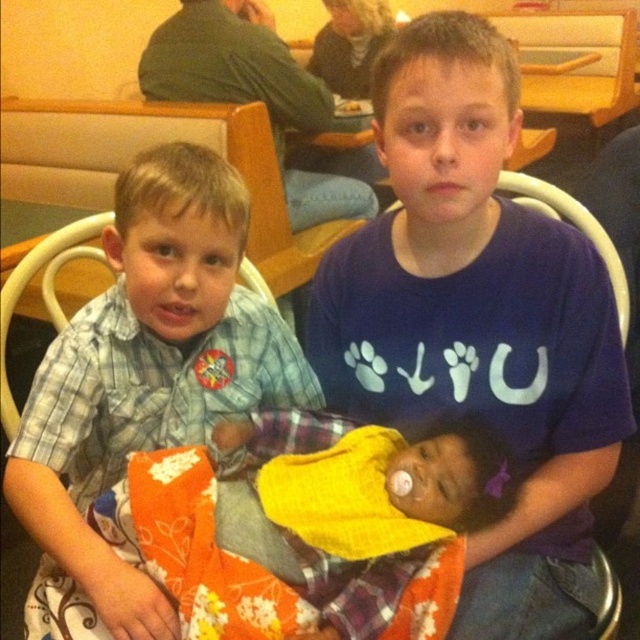
Can you confirm if blue cotton shirt at center is thinner than blue plaid shirt at center?

No.

Find the location of a particular element. The image size is (640, 640). blue cotton shirt at center is located at coordinates (477, 324).

Who is more distant from viewer, (x=412, y=68) or (x=218, y=547)?

Point (x=218, y=547)

Does blue cotton shirt at center have a lesser height compared to orange floral fabric at center?

No.

The image size is (640, 640). I want to click on blue cotton shirt at center, so click(x=477, y=324).

The height and width of the screenshot is (640, 640). What do you see at coordinates (298, 531) in the screenshot?
I see `orange floral fabric at center` at bounding box center [298, 531].

In the scene shown: Does orange floral fabric at center have a lesser width compared to blue plaid shirt at center?

In fact, orange floral fabric at center might be wider than blue plaid shirt at center.

At what (x,y) coordinates should I click in order to perform the action: click on orange floral fabric at center. Please return your answer as a coordinate pair (x, y). Looking at the image, I should click on (298, 531).

The image size is (640, 640). In order to click on orange floral fabric at center in this screenshot , I will do `click(298, 531)`.